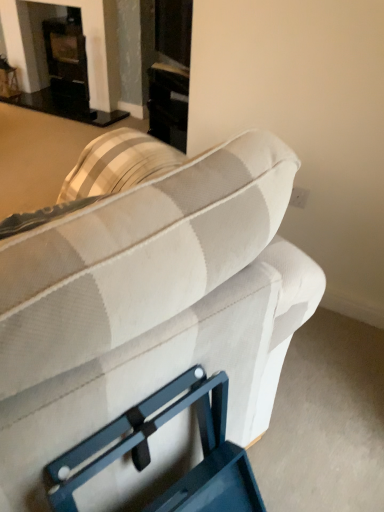
At what (x,y) coordinates should I click in order to perform the action: click on beige fabric couch at center. Please return your answer as a coordinate pair (x, y). The width and height of the screenshot is (384, 512). Looking at the image, I should click on (150, 305).

Describe the element at coordinates (150, 305) in the screenshot. I see `beige fabric couch at center` at that location.

Image resolution: width=384 pixels, height=512 pixels. Identify the location of black glass fireplace at upper left. (64, 58).

What do you see at coordinates (64, 58) in the screenshot? The width and height of the screenshot is (384, 512). I see `black glass fireplace at upper left` at bounding box center [64, 58].

Measure the distance between black glass fireplace at upper left and camera.

black glass fireplace at upper left and camera are 3.17 meters apart from each other.

I want to click on beige fabric couch at center, so click(x=150, y=305).

Can you confirm if beige fabric couch at center is positioned to the right of black glass fireplace at upper left?

Yes, beige fabric couch at center is to the right of black glass fireplace at upper left.

In the image, is beige fabric couch at center positioned in front of or behind black glass fireplace at upper left?

beige fabric couch at center is in front of black glass fireplace at upper left.

Is point (190, 295) farther from camera compared to point (111, 28)?

No, it is not.

Looking at this image, from the image's perspective, is beige fabric couch at center located above or below black glass fireplace at upper left?

beige fabric couch at center is situated lower than black glass fireplace at upper left in the image.

From a real-world perspective, which object stands above the other?

From a 3D spatial view, beige fabric couch at center is above.

Considering the relative sizes of beige fabric couch at center and black glass fireplace at upper left in the image provided, is beige fabric couch at center wider than black glass fireplace at upper left?

Indeed, beige fabric couch at center has a greater width compared to black glass fireplace at upper left.

Is beige fabric couch at center taller or shorter than black glass fireplace at upper left?

Considering their sizes, beige fabric couch at center has more height than black glass fireplace at upper left.

Between beige fabric couch at center and black glass fireplace at upper left, which one has larger size?

With larger size is beige fabric couch at center.

From the picture: Is beige fabric couch at center located outside black glass fireplace at upper left?

beige fabric couch at center is positioned outside black glass fireplace at upper left.

Is beige fabric couch at center directly adjacent to black glass fireplace at upper left?

No, beige fabric couch at center is not in contact with black glass fireplace at upper left.

Is beige fabric couch at center looking in the opposite direction of black glass fireplace at upper left?

beige fabric couch at center does not have its back to black glass fireplace at upper left.

Locate an element on the screen. The height and width of the screenshot is (512, 384). fireplace on the left of beige fabric couch at center is located at coordinates (64, 58).

Which object is positioned more to the right, black glass fireplace at upper left or beige fabric couch at center?

beige fabric couch at center is more to the right.

Between black glass fireplace at upper left and beige fabric couch at center, which one is positioned behind?

black glass fireplace at upper left is behind.

Which point is more distant from viewer, (83, 61) or (31, 320)?

The point (83, 61) is farther.

From the image's perspective, which one is positioned lower, black glass fireplace at upper left or beige fabric couch at center?

From the image's view, beige fabric couch at center is below.

From a real-world perspective, who is located higher, black glass fireplace at upper left or beige fabric couch at center?

In real-world perspective, beige fabric couch at center is above.

Looking at this image, between black glass fireplace at upper left and beige fabric couch at center, which one has smaller width?

With smaller width is black glass fireplace at upper left.

Is black glass fireplace at upper left taller or shorter than beige fabric couch at center?

In the image, black glass fireplace at upper left appears to be shorter than beige fabric couch at center.

Which of these two, black glass fireplace at upper left or beige fabric couch at center, is smaller?

black glass fireplace at upper left is smaller.

Would you say beige fabric couch at center is part of black glass fireplace at upper left's contents?

No, beige fabric couch at center is not inside black glass fireplace at upper left.

Is black glass fireplace at upper left placed right next to beige fabric couch at center?

There is a gap between black glass fireplace at upper left and beige fabric couch at center.

Based on the photo, is black glass fireplace at upper left positioned with its back to beige fabric couch at center?

That's not correct — black glass fireplace at upper left is not looking away from beige fabric couch at center.

What's the angular difference between black glass fireplace at upper left and beige fabric couch at center's facing directions?

The facing directions of black glass fireplace at upper left and beige fabric couch at center are 112 degrees apart.

This screenshot has width=384, height=512. I want to click on fireplace that is above the beige fabric couch at center (from the image's perspective), so click(x=64, y=58).

Image resolution: width=384 pixels, height=512 pixels. What are the coordinates of `fireplace to the left of beige fabric couch at center` in the screenshot? It's located at (64, 58).

This screenshot has width=384, height=512. Find the location of `fireplace above the beige fabric couch at center (from the image's perspective)`. fireplace above the beige fabric couch at center (from the image's perspective) is located at coordinates (64, 58).